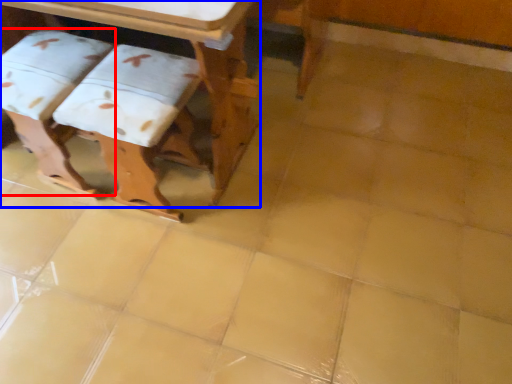
Question: Among these objects, which one is nearest to the camera, step stool (highlighted by a red box) or table (highlighted by a blue box)?

Choices:
 (A) step stool
 (B) table

Answer: (B)